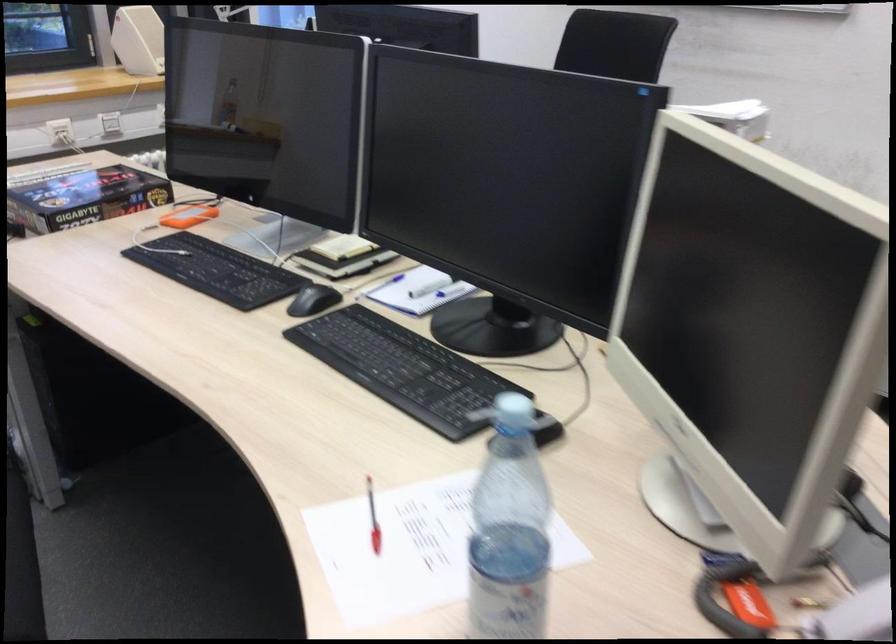
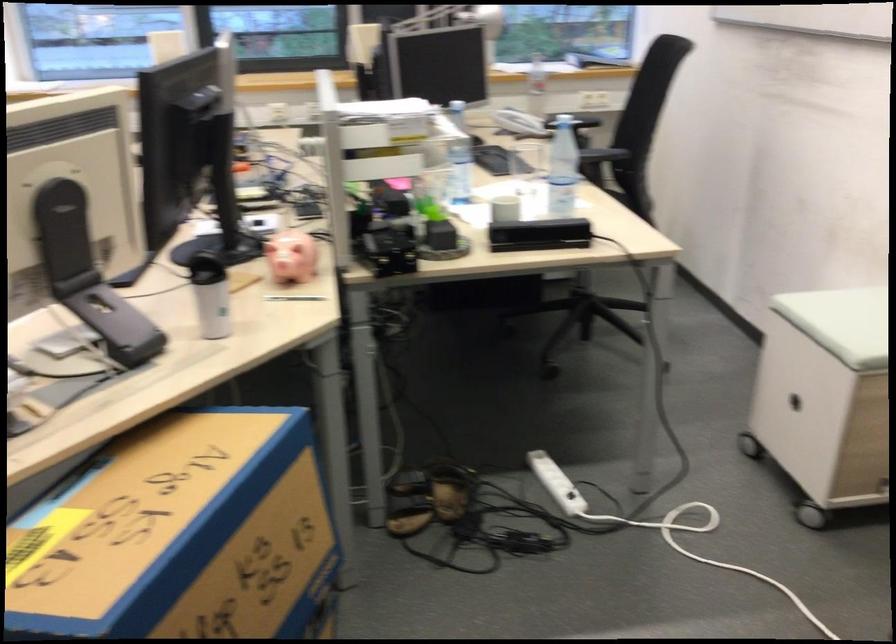
Question: I am providing you with two images of the same scene from different viewpoints. After the viewpoint changes to image2, which objects are now occluded?

Choices:
 (A) stool sitting surface
 (B) spiral bound notebook
 (C) orange pen
 (D) white coffee mug

Answer: (B)